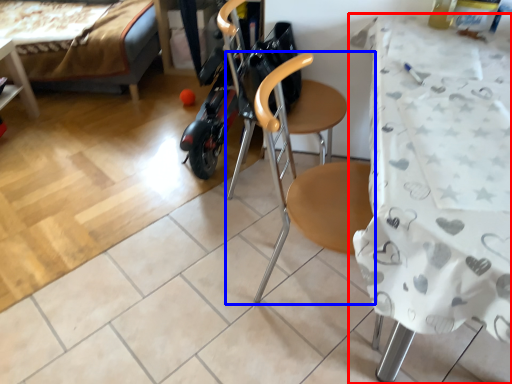
Question: Which of the following is the closest to the observer, table (highlighted by a red box) or chair (highlighted by a blue box)?

Choices:
 (A) table
 (B) chair

Answer: (A)